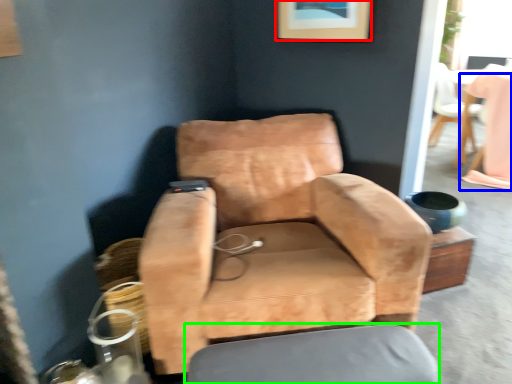
Question: Estimate the real-world distances between objects in this image. Which object is farther from picture frame (highlighted by a red box), table (highlighted by a blue box) or swivel chair (highlighted by a green box)?

Choices:
 (A) table
 (B) swivel chair

Answer: (A)